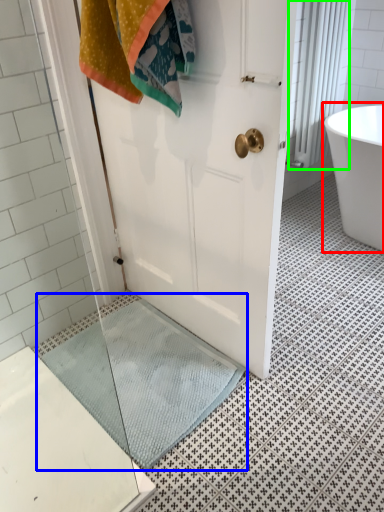
Question: Which object is the farthest from bathtub (highlighted by a red box)? Choose among these: bath mat (highlighted by a blue box) or shower curtain (highlighted by a green box).

Choices:
 (A) bath mat
 (B) shower curtain

Answer: (A)